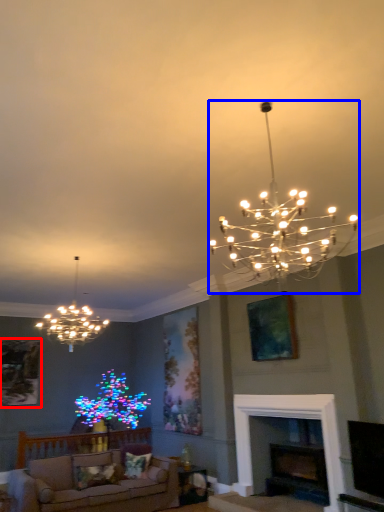
Question: Among these objects, which one is nearest to the camera, picture frame (highlighted by a red box) or lamp (highlighted by a blue box)?

Choices:
 (A) picture frame
 (B) lamp

Answer: (B)